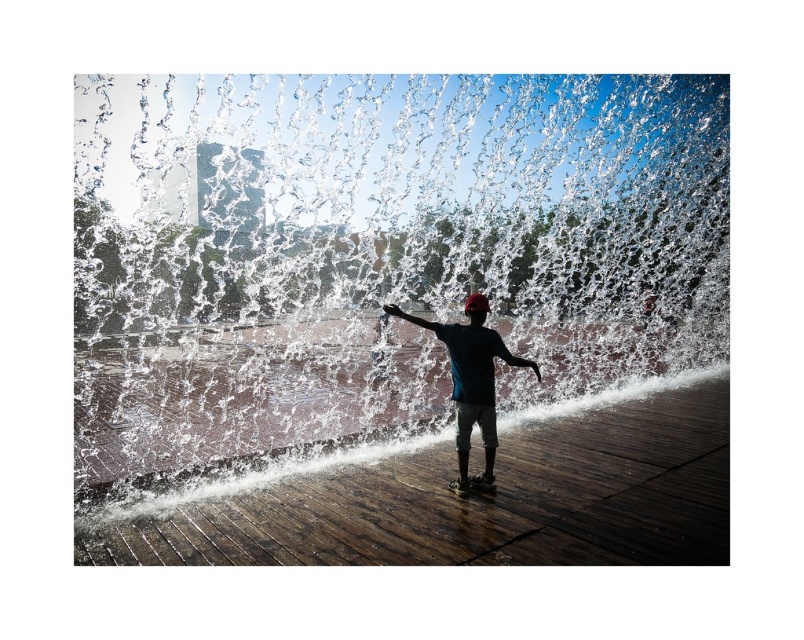
Can you confirm if clear water at center is smaller than dark blue fabric shirt at center?

Incorrect, clear water at center is not smaller in size than dark blue fabric shirt at center.

Image resolution: width=804 pixels, height=640 pixels. I want to click on clear water at center, so click(x=402, y=273).